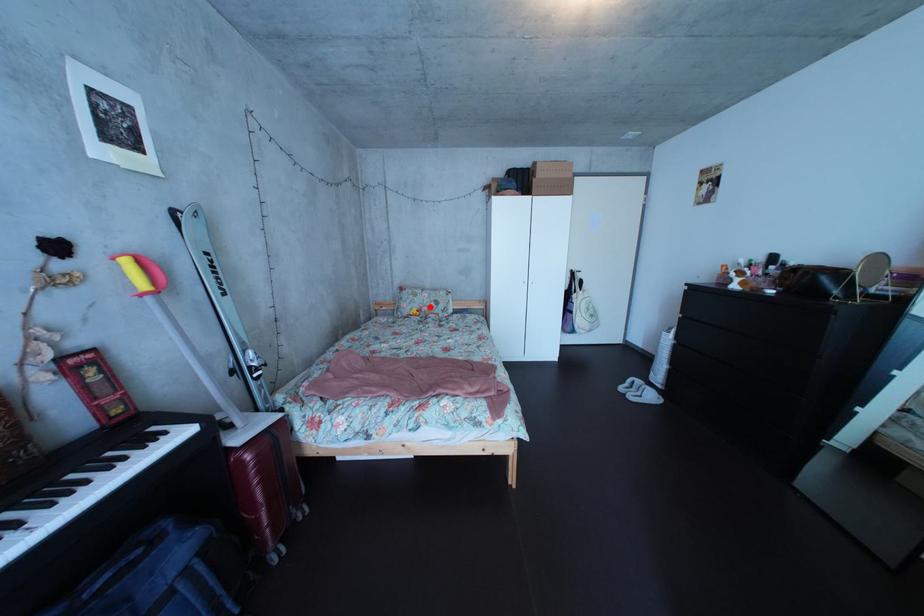
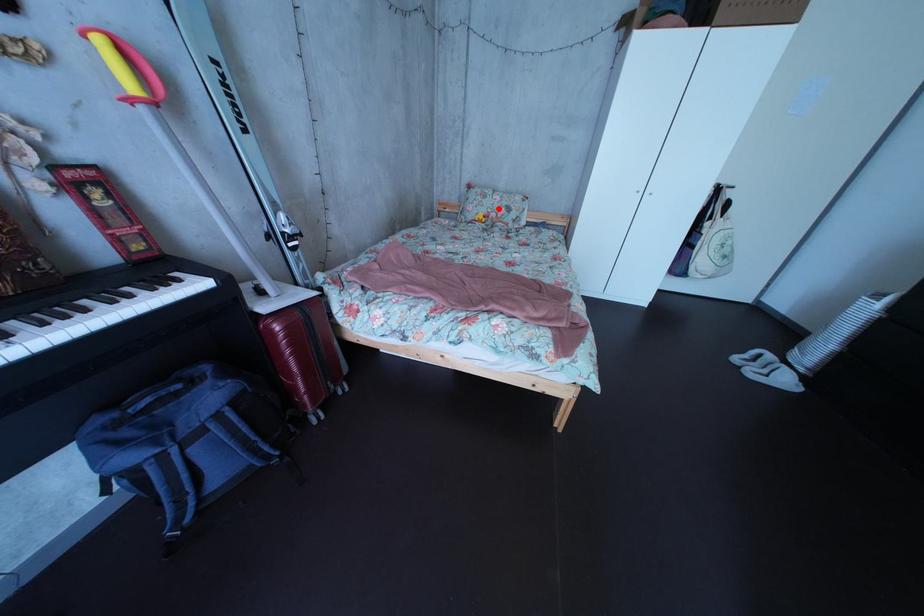
I am providing you with two images of the same scene from different viewpoints. A red point is marked on the first image and another point is marked on the second image. Does the point marked in image1 correspond to the same location as the one in image2?

Yes